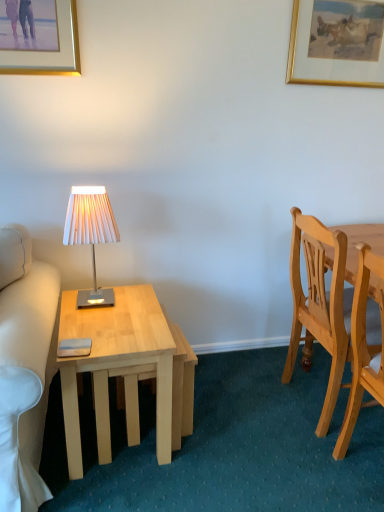
The width and height of the screenshot is (384, 512). Find the location of `free space to the left of light wood chair at right, arranged as the first chair when viewed from the back`. free space to the left of light wood chair at right, arranged as the first chair when viewed from the back is located at coordinates (248, 406).